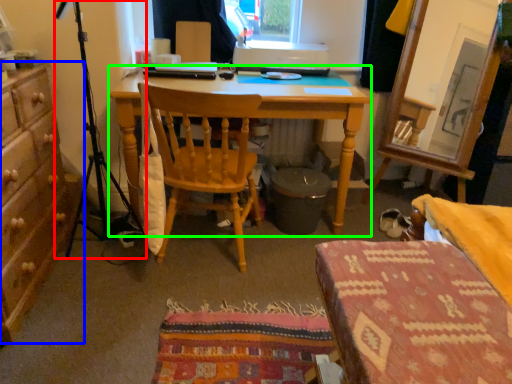
Question: Which object is positioned farthest from tripod (highlighted by a red box)? Select from cabinetry (highlighted by a blue box) and desk (highlighted by a green box).

Choices:
 (A) cabinetry
 (B) desk

Answer: (B)